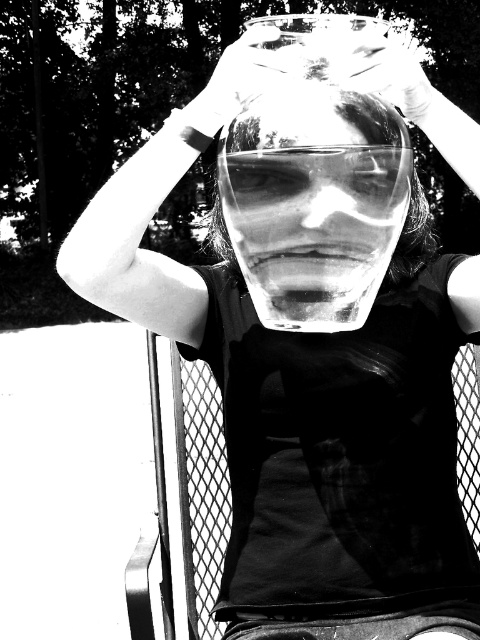
Is transparent plastic hand at upper center shorter than translucent plastic hand at upper center?

Incorrect, transparent plastic hand at upper center's height does not fall short of translucent plastic hand at upper center's.

This screenshot has width=480, height=640. What do you see at coordinates (247, 74) in the screenshot? I see `transparent plastic hand at upper center` at bounding box center [247, 74].

At what (x,y) coordinates should I click in order to perform the action: click on transparent plastic hand at upper center. Please return your answer as a coordinate pair (x, y). The width and height of the screenshot is (480, 640). Looking at the image, I should click on (247, 74).

Which is above, transparent glass at center or translucent plastic hand at upper center?

translucent plastic hand at upper center is higher up.

Is transparent glass at center below translucent plastic hand at upper center?

Correct, transparent glass at center is located below translucent plastic hand at upper center.

Describe the element at coordinates (313, 179) in the screenshot. I see `transparent glass at center` at that location.

Where is `transparent glass at center`? This screenshot has width=480, height=640. transparent glass at center is located at coordinates (313, 179).

Which is in front, point (311, 221) or point (278, 65)?

Positioned in front is point (311, 221).

Does transparent glass at center have a lesser height compared to transparent plastic hand at upper center?

Yes, transparent glass at center is shorter than transparent plastic hand at upper center.

I want to click on transparent glass at center, so click(x=313, y=179).

Identify the location of transparent glass at center. The width and height of the screenshot is (480, 640). (313, 179).